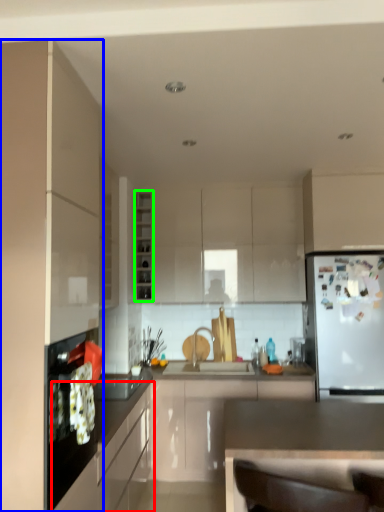
Question: Considering the real-world distances, which object is farthest from cabinetry (highlighted by a red box)? cabinetry (highlighted by a blue box) or cabinetry (highlighted by a green box)?

Choices:
 (A) cabinetry
 (B) cabinetry

Answer: (B)